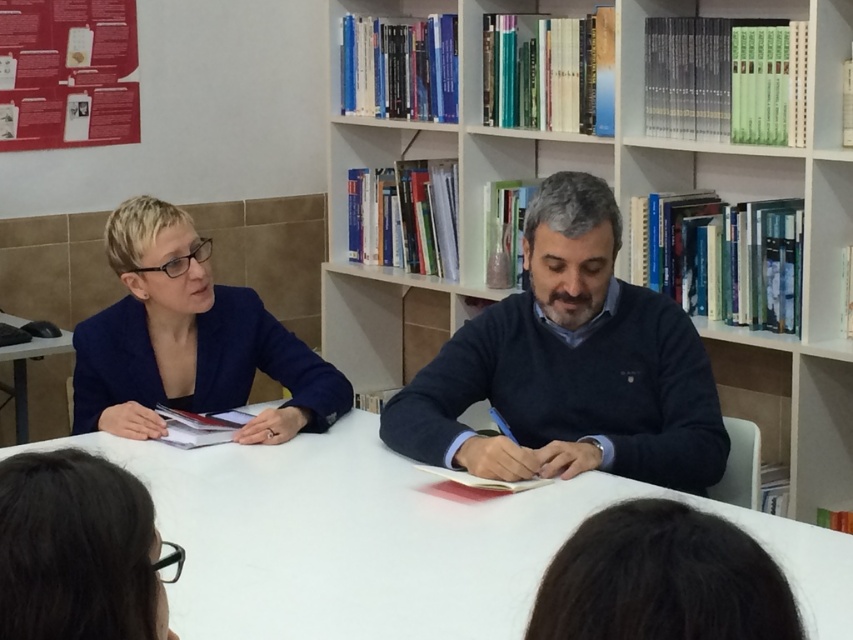
You are a person who is 1.6 meters tall standing at the white smooth table at center. You want to reach the dark brown hair at lower left. Can you reach it without moving your feet?

The distance between the white smooth table at center and the dark brown hair at lower left is 87.06 centimeters. Since you are 1.6 meters tall, your arms can extend approximately 60 centimeters from your body. Therefore, you can reach the dark brown hair at lower left without moving your feet.

You are a person sitting at the white smooth table at center and want to hand a book to the person wearing the blue fabric jacket at left. Which direction should you move to reach them?

The white smooth table at center is positioned on the right side of blue fabric jacket at left, so you should move to your left to reach the person wearing the blue fabric jacket at left.